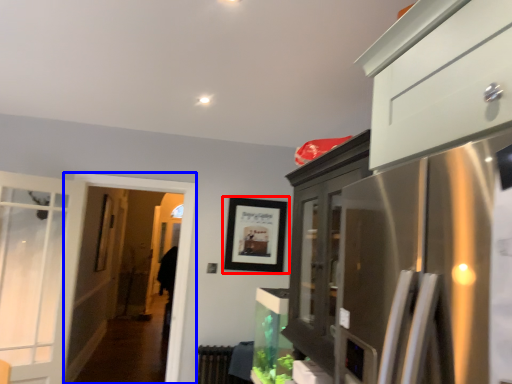
Question: Which object appears farthest to the camera in this image, picture frame (highlighted by a red box) or screen door (highlighted by a blue box)?

Choices:
 (A) picture frame
 (B) screen door

Answer: (A)